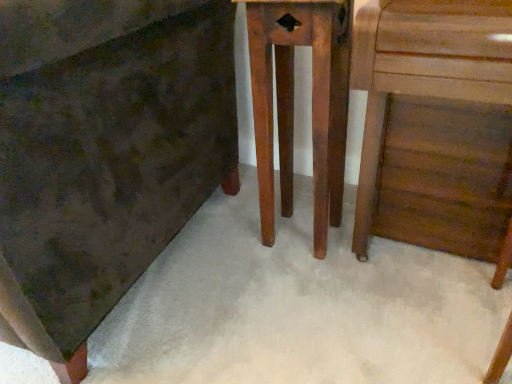
Where is `vacant space situated on the left part of wooden table at center`? vacant space situated on the left part of wooden table at center is located at coordinates (228, 239).